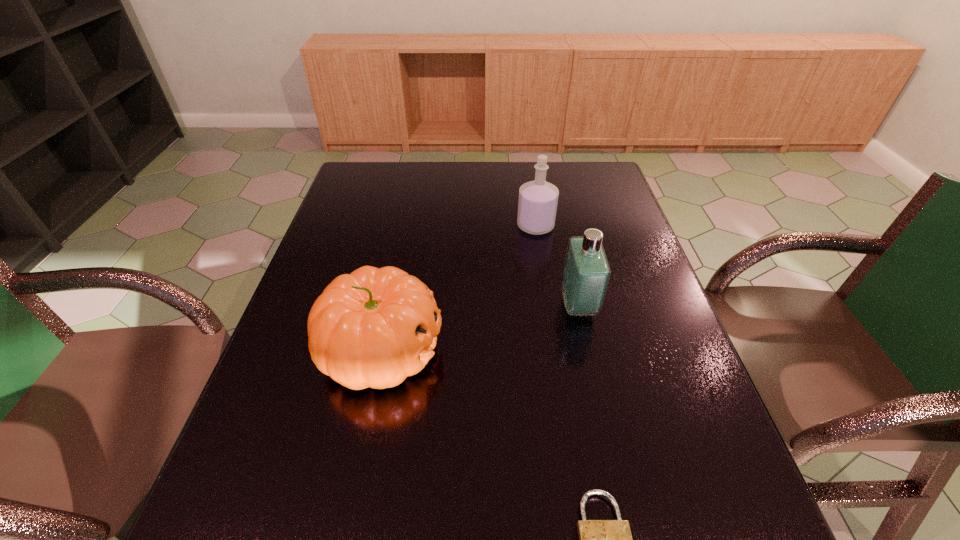
At what (x,y) coordinates should I click in order to perform the action: click on free space at the near edge of the desktop. Please return your answer as a coordinate pair (x, y). The height and width of the screenshot is (540, 960). Looking at the image, I should click on point(300,538).

You are a GUI agent. You are given a task and a screenshot of the screen. Output one action in this format:
    pyautogui.click(x=<x>, y=<y>)
    Task: Click on the free space at the left edge
    
    Given the screenshot: What is the action you would take?
    pyautogui.click(x=354, y=226)

This screenshot has height=540, width=960. In the image, there is a desktop. In order to click on blank space at the right edge in this screenshot , I will do `click(610, 240)`.

This screenshot has width=960, height=540. What are the coordinates of `free space at the far right corner of the desktop` in the screenshot? It's located at (586, 194).

Locate an element on the screen. free space between the nearer perfume and the leftmost object is located at coordinates (480, 327).

Where is `free space that is in between the leftmost object and the farther perfume`? The image size is (960, 540). free space that is in between the leftmost object and the farther perfume is located at coordinates (458, 287).

The image size is (960, 540). Identify the location of empty space that is in between the nearer perfume and the farthest object. (557, 266).

Identify the location of free space between the leftmost object and the farther perfume. (458, 287).

At what (x,y) coordinates should I click in order to perform the action: click on vacant space that's between the farther perfume and the pumpkin. Please return your answer as a coordinate pair (x, y). Looking at the image, I should click on (458, 287).

Identify the location of free space between the farthest object and the pumpkin. (458, 287).